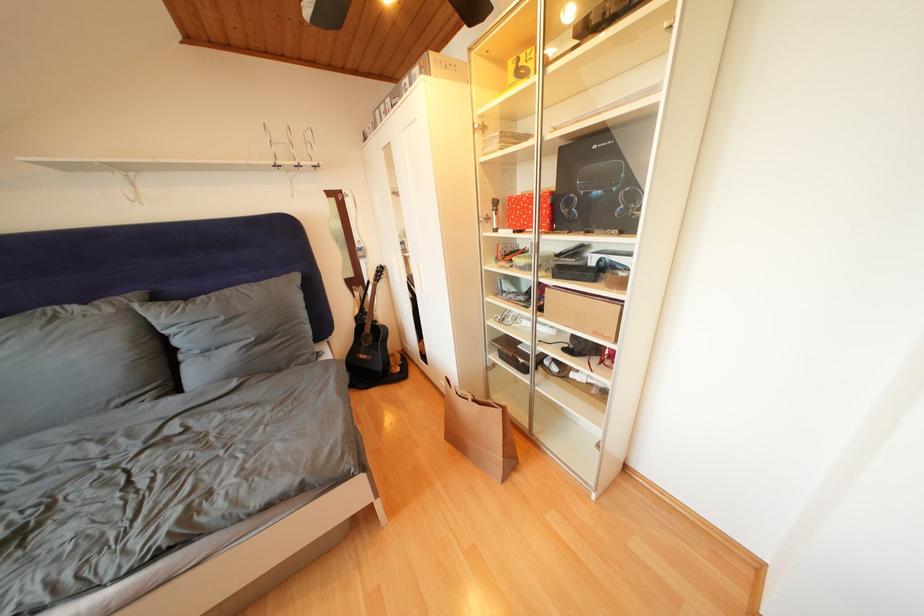
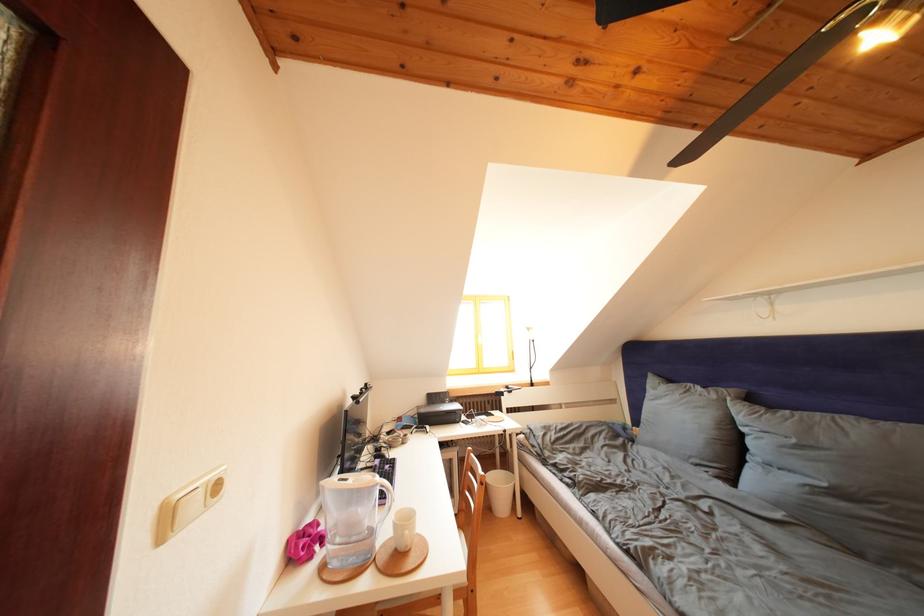
Locate, in the second image, the point that corresponds to [231,323] in the first image.

(801, 446)